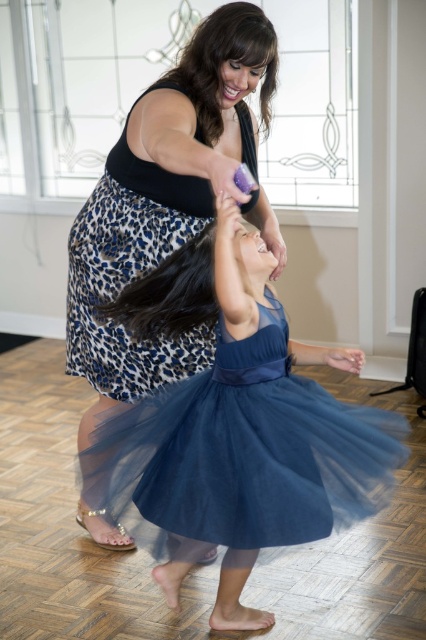
Does navy tulle dress at center have a smaller size compared to leopard print skirt at center?

Correct, navy tulle dress at center occupies less space than leopard print skirt at center.

Who is positioned more to the left, navy tulle dress at center or leopard print skirt at center?

Positioned to the left is leopard print skirt at center.

Is point (314, 500) behind point (75, 230)?

No, it is not.

The width and height of the screenshot is (426, 640). In order to click on navy tulle dress at center in this screenshot , I will do `click(235, 428)`.